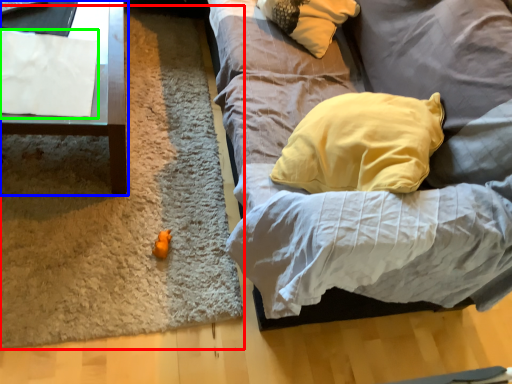
Question: Which object is positioned closest to mat (highlighted by a red box)? Select from furniture (highlighted by a blue box) and sheet (highlighted by a green box).

Choices:
 (A) furniture
 (B) sheet

Answer: (A)